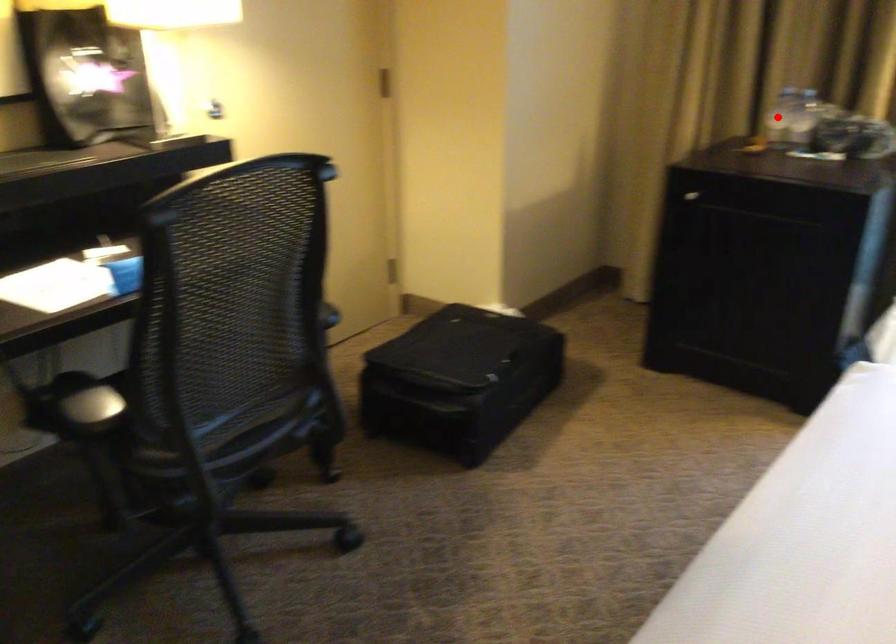
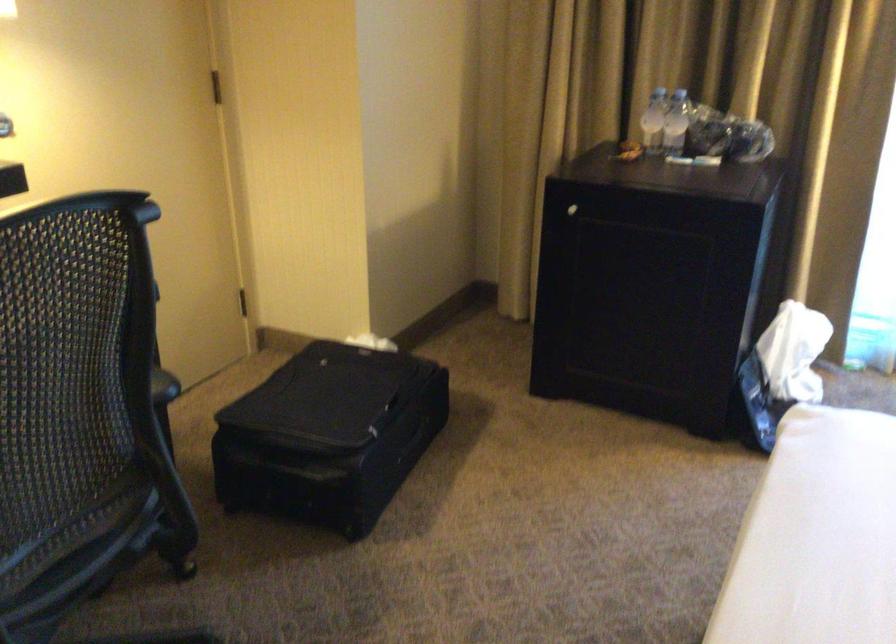
In the second image, find the point that corresponds to the highlighted location in the first image.

(653, 120)